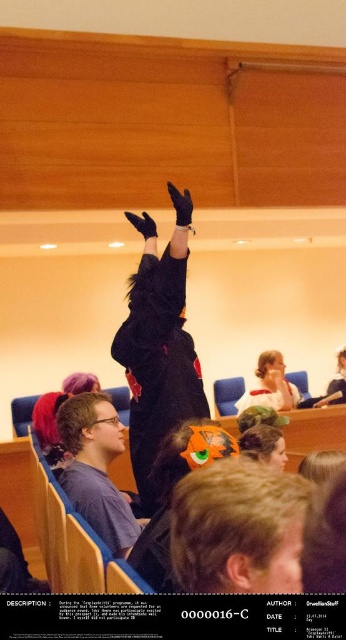
Question: Among these objects, which one is nearest to the camera?

Choices:
 (A) blonde hair at center
 (B) smooth plastic spoon at lower center
 (C) black plush at center

Answer: (A)

Question: Which point is closer to the camera?

Choices:
 (A) black plush at center
 (B) blonde hair at center
 (C) smooth plastic spoon at lower center

Answer: (B)

Question: Can you confirm if blonde hair at center is positioned below matte gray shirt at center?

Choices:
 (A) yes
 (B) no

Answer: (B)

Question: Is black plush at center positioned before matte gray shirt at center?

Choices:
 (A) yes
 (B) no

Answer: (B)

Question: Which object is the closest to the blonde hair at center?

Choices:
 (A) matte gray shirt at center
 (B) smooth plastic spoon at lower center
 (C) black plush at center

Answer: (A)

Question: Is matte gray shirt at center positioned behind smooth plastic spoon at lower center?

Choices:
 (A) yes
 (B) no

Answer: (B)